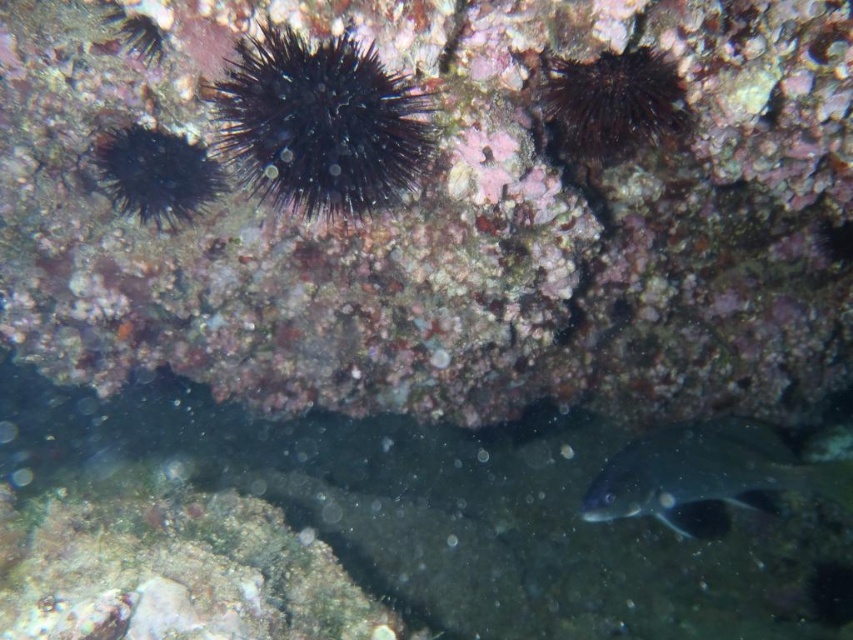
You are a marine biologist examining the underwater scene. You notice two points of interest marked as point (354, 145) and point (639, 456). Which point is nearer to you?

Point (354, 145) is closer to the viewer than point (639, 456).

You are a marine biologist observing this underwater scene. You need to collect samples from both the silvery metallic fish at lower right and the black spiny at left. Given that your collection tool has a maximum reach of 6 feet, can you collect both samples without moving the tool?

The silvery metallic fish at lower right and black spiny at left are 6.14 feet apart. Since the distance between them exceeds the tool reach of 6 feet, you cannot collect both samples without moving the tool.